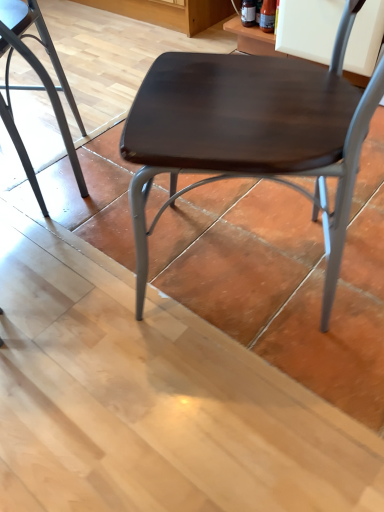
This screenshot has height=512, width=384. I want to click on free spot in front of dark wood/matte chair at center, placed as the 1th chair when sorted from right to left, so click(242, 404).